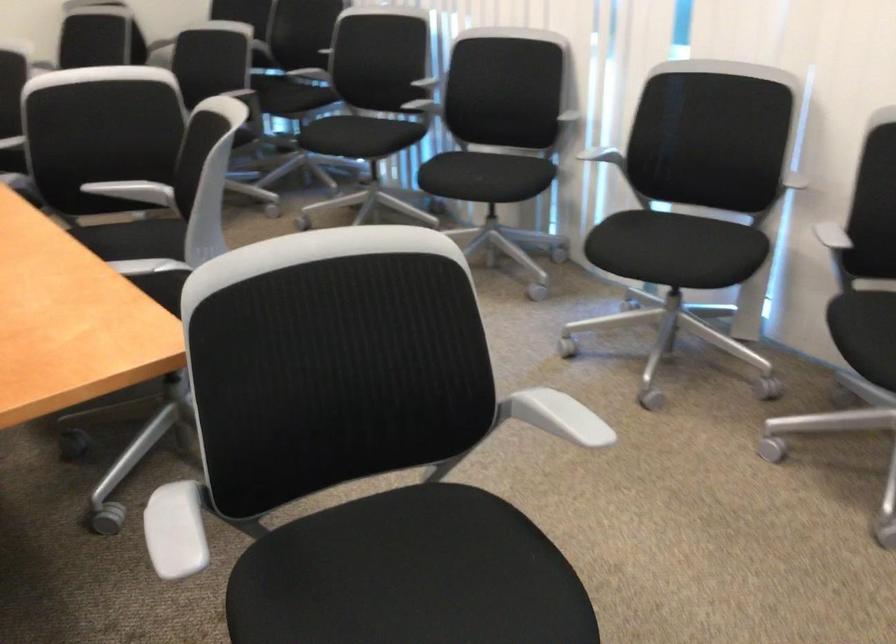
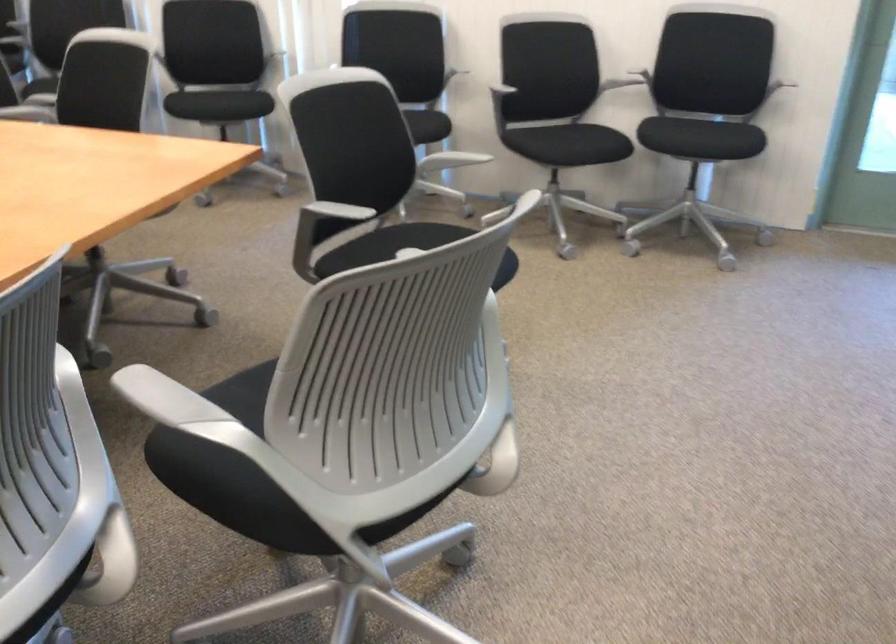
Locate, in the second image, the point that corresponds to point 711,270 in the first image.

(426, 126)